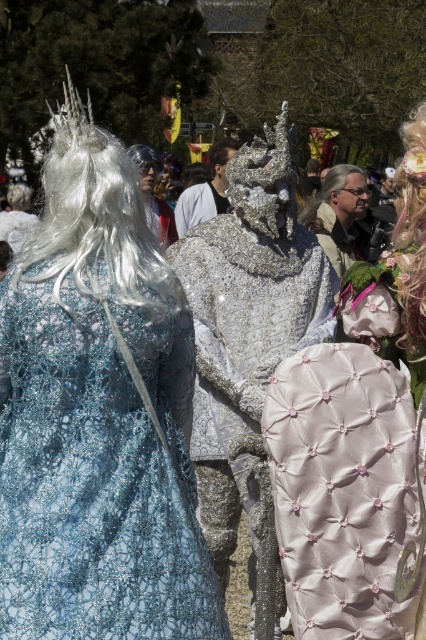
Question: Does glittery blue dress at upper left have a larger size compared to white glittery wig at upper left?

Choices:
 (A) no
 (B) yes

Answer: (B)

Question: Which point is farther from the camera taking this photo?

Choices:
 (A) (143, 289)
 (B) (298, 273)

Answer: (B)

Question: Is glittery blue dress at upper left positioned in front of shiny silver armor at center?

Choices:
 (A) no
 (B) yes

Answer: (B)

Question: Which point is closer to the camera taking this photo?

Choices:
 (A) (219, 532)
 (B) (14, 556)
 (C) (419, 157)
 (D) (216, 157)

Answer: (B)

Question: Which of the following is the closest to the observer?

Choices:
 (A) (58, 164)
 (B) (250, 259)
 (C) (411, 202)

Answer: (A)

Question: Does glittery blue dress at upper left appear on the left side of shiny silver armor at center?

Choices:
 (A) yes
 (B) no

Answer: (A)